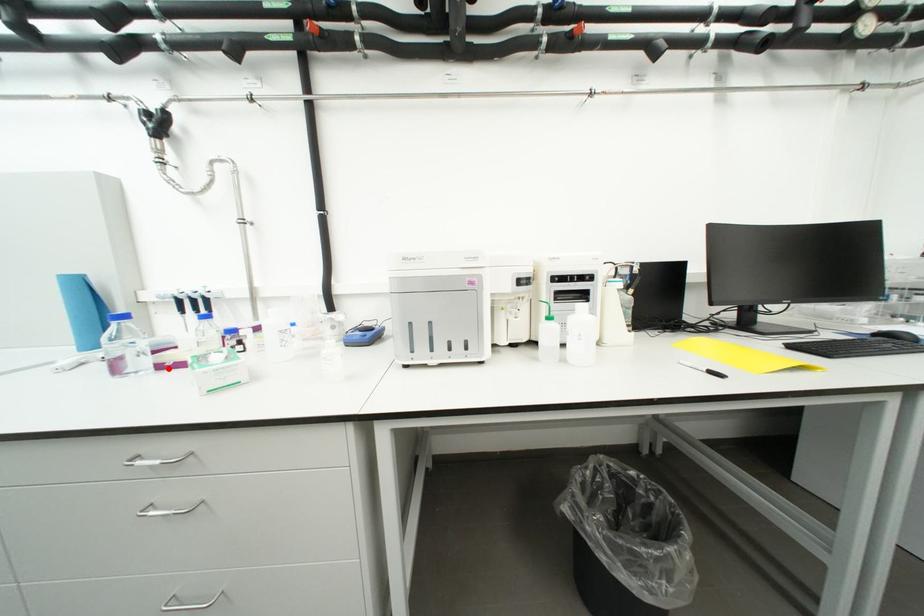
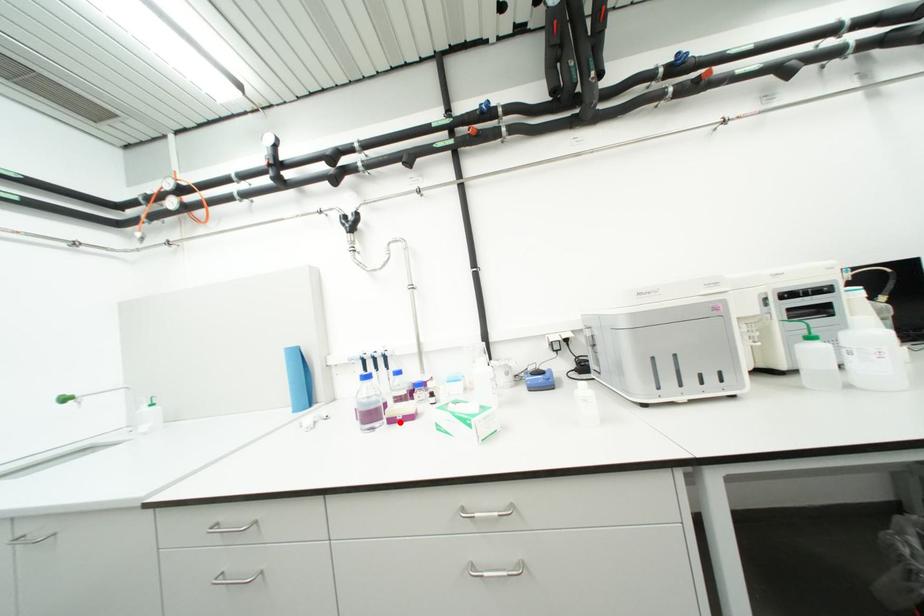
I am providing you with two images of the same scene from different viewpoints. A red point is marked on the first image and another point is marked on the second image. Does the point marked in image1 correspond to the same location as the one in image2?

Yes